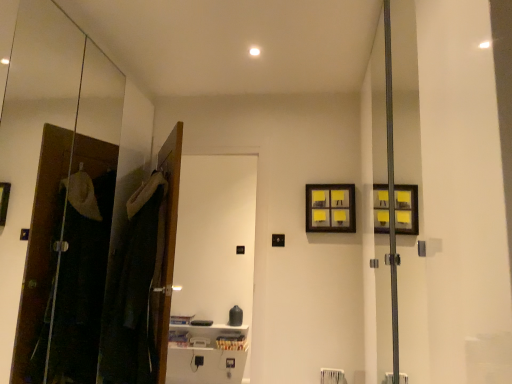
Question: From the image's perspective, is dark fabric laundry at left on top of white glossy screen door at center?

Choices:
 (A) no
 (B) yes

Answer: (B)

Question: Can you confirm if dark fabric laundry at left is bigger than white glossy screen door at center?

Choices:
 (A) yes
 (B) no

Answer: (B)

Question: From the image's perspective, does dark fabric laundry at left appear lower than white glossy screen door at center?

Choices:
 (A) yes
 (B) no

Answer: (B)

Question: Does dark fabric laundry at left appear on the right side of white glossy screen door at center?

Choices:
 (A) no
 (B) yes

Answer: (A)

Question: Are dark fabric laundry at left and white glossy screen door at center making contact?

Choices:
 (A) yes
 (B) no

Answer: (B)

Question: Is white glossy screen door at center a part of dark fabric laundry at left?

Choices:
 (A) yes
 (B) no

Answer: (B)

Question: Is white glossy screen door at center at the left side of dark fabric laundry at left?

Choices:
 (A) yes
 (B) no

Answer: (B)

Question: From the image's perspective, is white glossy screen door at center below dark fabric laundry at left?

Choices:
 (A) no
 (B) yes

Answer: (B)

Question: Is dark fabric laundry at left located within white glossy screen door at center?

Choices:
 (A) yes
 (B) no

Answer: (B)

Question: Is white glossy screen door at center next to dark fabric laundry at left and touching it?

Choices:
 (A) yes
 (B) no

Answer: (B)

Question: Could you tell me if white glossy screen door at center is turned towards dark fabric laundry at left?

Choices:
 (A) yes
 (B) no

Answer: (A)

Question: Considering the relative positions of white glossy screen door at center and dark fabric laundry at left in the image provided, is white glossy screen door at center behind dark fabric laundry at left?

Choices:
 (A) yes
 (B) no

Answer: (A)

Question: Is yellow paper at upper right far from dark fabric laundry at left?

Choices:
 (A) yes
 (B) no

Answer: (A)